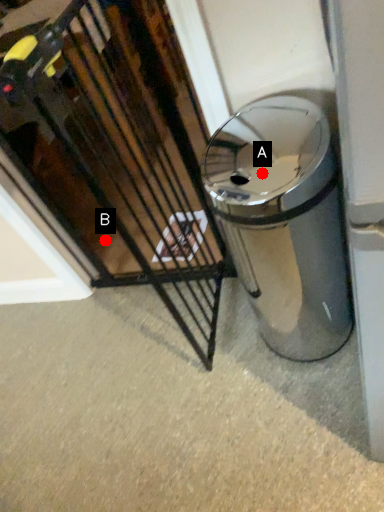
Question: Two points are circled on the image, labeled by A and B beside each circle. Which of the following is the farthest from the observer?

Choices:
 (A) A is further
 (B) B is further

Answer: (B)